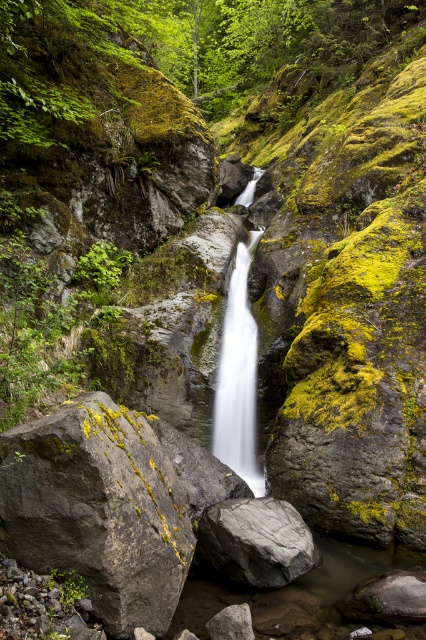
You are a photographer planning to capture the gray rock at center and the white smooth waterfall at center in a single frame. Given that your camera can only focus on objects wider than 20 cm, which object will definitely be in focus?

The gray rock at center will definitely be in focus because its width is larger than the white smooth waterfall at center, and since the camera requires objects wider than 20 cm, the gray rock meets this requirement while the waterfall may not.

You are a hiker standing at the edge of the cliff looking at the gray rock at center and the white smooth waterfall at center. Which object is nearer to you?

The gray rock at center is closer to the viewer than the white smooth waterfall at center.